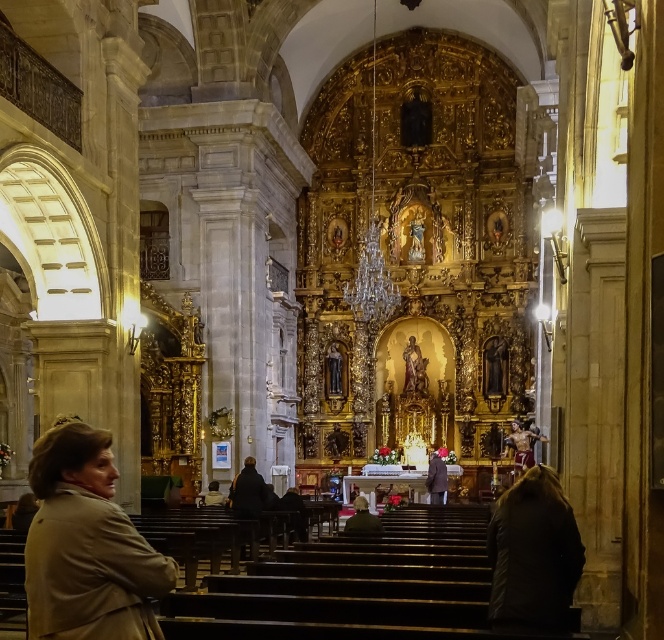
You are standing in the grand church and want to place a small bouquet of flowers on the floor near the beige fabric coat at lower left. Based on the coordinates provided, where should you place the flowers to ensure they are closest to the coat?

The beige fabric coat at lower left is located at coordinates point (86, 545), so placing the flowers near that point would ensure they are closest to the coat.

You are standing in the grand church facing the altar. There are two points marked in the scene. The first point is at coordinate point (29, 625) and the second is at point (349, 532). Which point is closer to you as you face the altar?

Point (29, 625) is closer to you because it is in front of point (349, 532) when facing the altar.